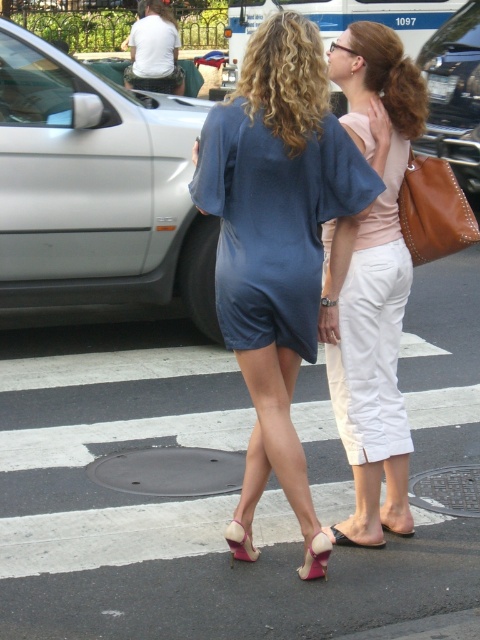
You are a shoe designer observing the two sandals in the image. Which sandal has a larger size between the pink suede sandal at center and the black leather sandal at lower center?

The pink suede sandal at center is larger in size than the black leather sandal at lower center according to the description.

You are a delivery person who needs to place a metallic silver car at center and a pink suede sandal at center into two boxes. The first box can only hold items taller than 1 meter. The second box can only hold items shorter than 1 meter. Which item goes into which box?

The metallic silver car at center is taller than the pink suede sandal at center. Since the metallic silver car at center has a greater height, it should go into the first box for items taller than 1 meter. The pink suede sandal at center, being shorter, would fit into the second box for items under 1 meter.

In the scene shown: You are a pedestrian crossing the street and notice the silver metallic car at left and the black leather sandal at lower center. Which object is wider?

The silver metallic car at left is wider than the black leather sandal at lower center.